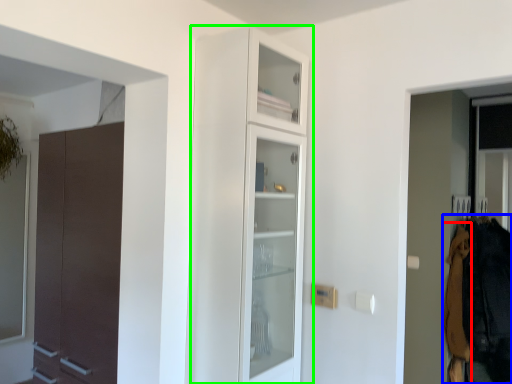
Question: Estimate the real-world distances between objects in this image. Which object is closer to clothing (highlighted by a red box), clothing (highlighted by a blue box) or cupboard (highlighted by a green box)?

Choices:
 (A) clothing
 (B) cupboard

Answer: (A)